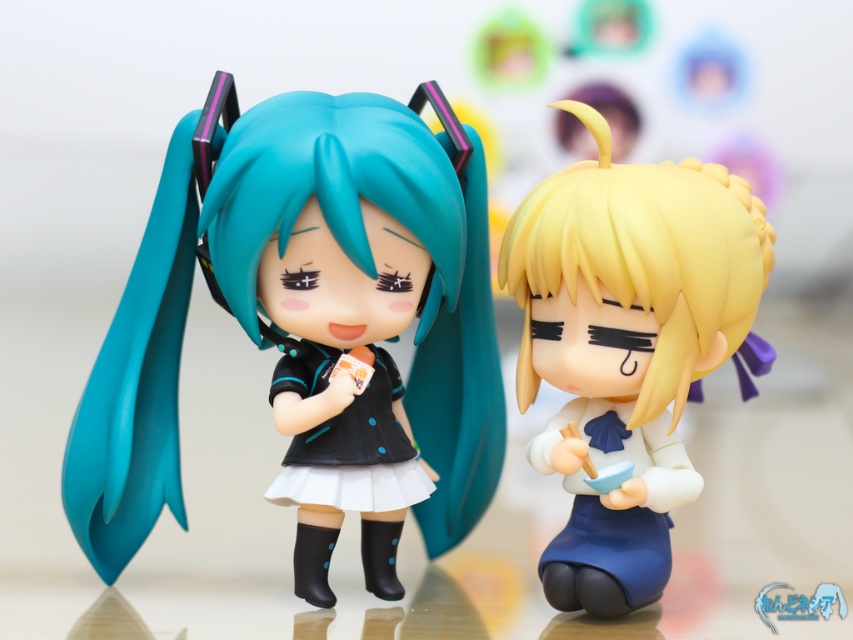
Question: Does matte black figure at left appear under satin blonde hair at right?

Choices:
 (A) no
 (B) yes

Answer: (A)

Question: Is matte black figure at left below satin blonde hair at right?

Choices:
 (A) yes
 (B) no

Answer: (B)

Question: Does matte black figure at left appear on the right side of satin blonde hair at right?

Choices:
 (A) no
 (B) yes

Answer: (A)